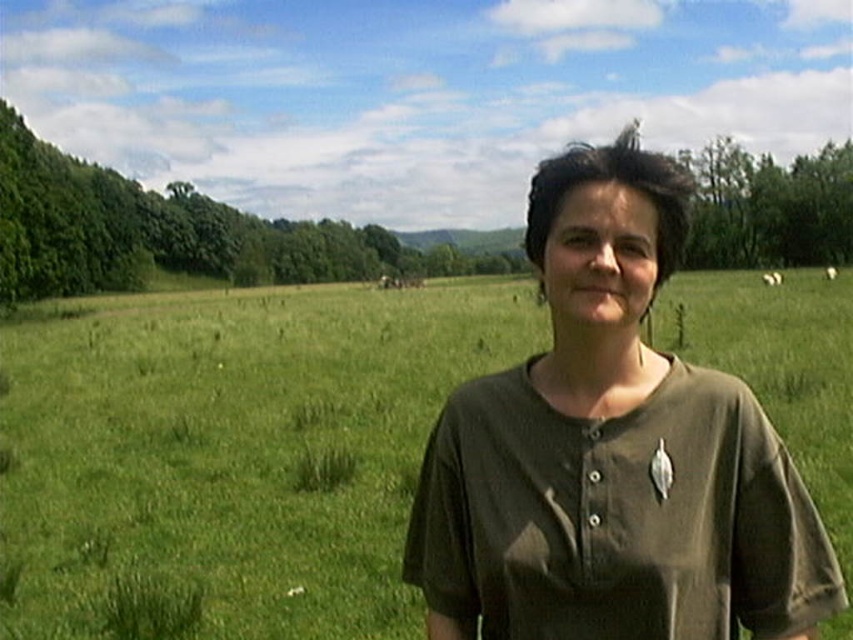
Question: Which point appears closest to the camera in this image?

Choices:
 (A) (598, 621)
 (B) (152, 436)

Answer: (A)

Question: Is green grass pasture at center positioned in front of olive-green cotton shirt at center?

Choices:
 (A) no
 (B) yes

Answer: (A)

Question: Which of the following is the closest to the observer?

Choices:
 (A) (601, 579)
 (B) (259, 374)

Answer: (A)

Question: Is green grass pasture at center below olive-green cotton shirt at center?

Choices:
 (A) yes
 (B) no

Answer: (B)

Question: Can you confirm if green grass pasture at center is bigger than olive-green cotton shirt at center?

Choices:
 (A) no
 (B) yes

Answer: (B)